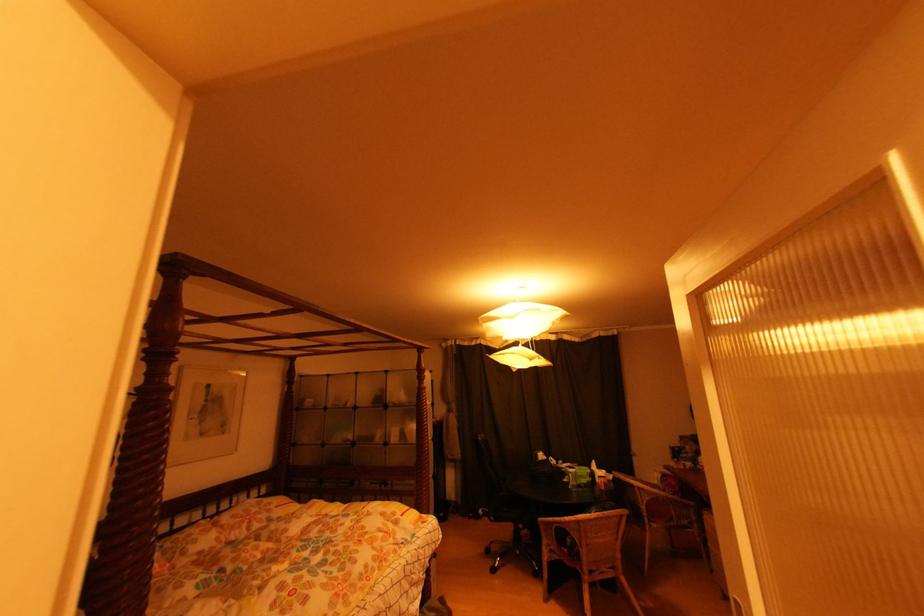
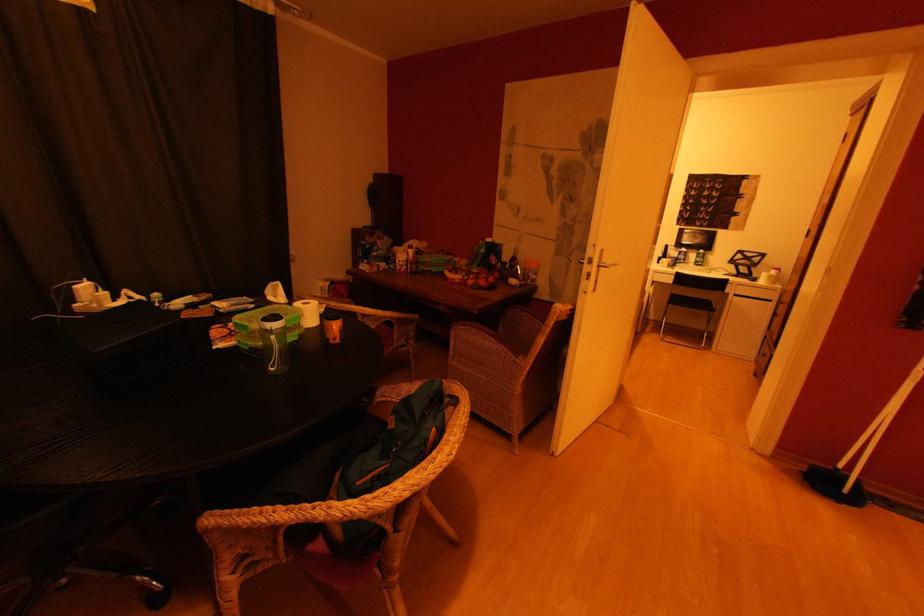
Question: I am providing you with two images of the same scene from different viewpoints. Please identify which objects are invisible in image2.

Choices:
 (A) white paper roll
 (B) orange cup
 (C) silver door handle
 (D) none of these

Answer: (D)